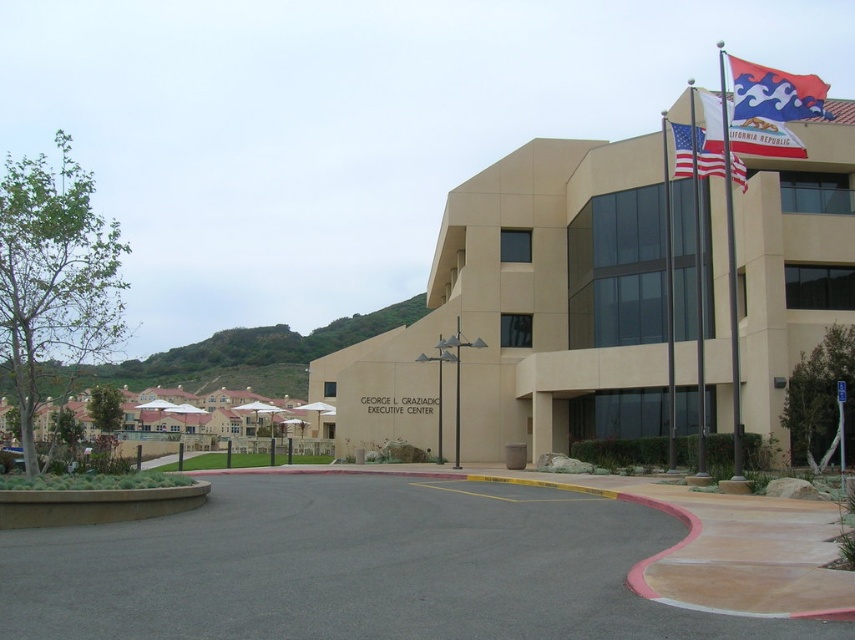
Which is in front, point (553, 244) or point (736, 321)?

Point (736, 321) is more forward.

Is beige concrete building at upper right bigger than white flagpole at upper right?

No, beige concrete building at upper right is not bigger than white flagpole at upper right.

I want to click on beige concrete building at upper right, so click(528, 310).

Find the location of a particular element. Image resolution: width=855 pixels, height=640 pixels. beige concrete building at upper right is located at coordinates click(528, 310).

Who is more distant from viewer, (792,104) or (721,56)?

The point (721,56) is behind.

In the scene shown: Which is more to the right, blue and white fabric flag at upper right or white flagpole at upper right?

From the viewer's perspective, blue and white fabric flag at upper right appears more on the right side.

Where is `blue and white fabric flag at upper right`? blue and white fabric flag at upper right is located at coordinates (775, 93).

Which of these two, red fabric flag at upper right or metallic flag pole at upper right, stands shorter?

Standing shorter between the two is red fabric flag at upper right.

Measure the distance between red fabric flag at upper right and camera.

The distance of red fabric flag at upper right from camera is 20.30 meters.

Locate an element on the screen. This screenshot has width=855, height=640. red fabric flag at upper right is located at coordinates (746, 132).